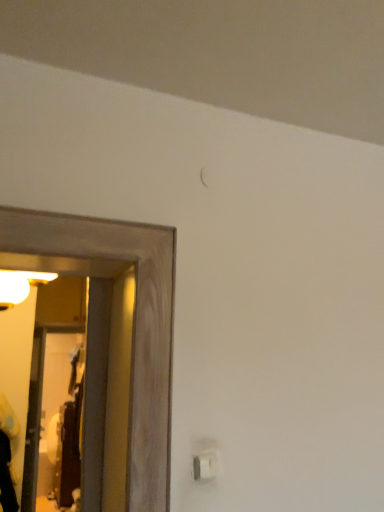
The height and width of the screenshot is (512, 384). What do you see at coordinates (205, 466) in the screenshot? I see `white plastic light switch at lower right` at bounding box center [205, 466].

Measure the distance between point (193, 468) and camera.

Point (193, 468) and camera are 3.81 feet apart from each other.

Locate an element on the screen. white plastic light switch at lower right is located at coordinates (205, 466).

Find the location of a particular element. This screenshot has height=512, width=384. white plastic light switch at lower right is located at coordinates (205, 466).